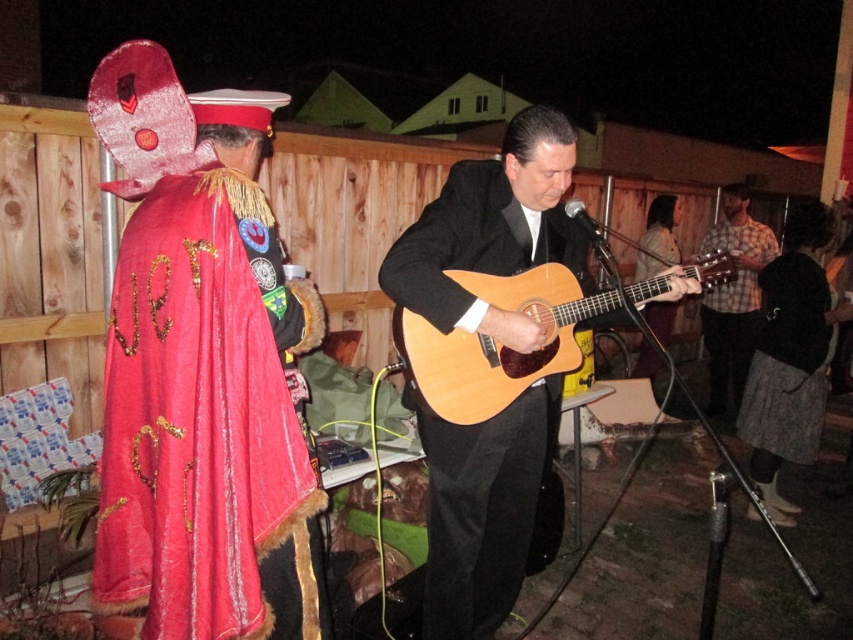
Who is taller, velvet red cape at left or wooden acoustic guitar at center?

With more height is wooden acoustic guitar at center.

Which is in front, point (196, 339) or point (650, 262)?

Positioned in front is point (196, 339).

Identify the location of velvet red cape at left. The image size is (853, 640). (201, 372).

Does natural wood acoustic guitar at center come in front of wooden acoustic guitar at center?

Yes.

The height and width of the screenshot is (640, 853). In order to click on natural wood acoustic guitar at center in this screenshot , I will do `click(495, 342)`.

Is point (451, 385) behind point (660, 337)?

No, it is not.

At what (x,y) coordinates should I click in order to perform the action: click on natural wood acoustic guitar at center. Please return your answer as a coordinate pair (x, y). The width and height of the screenshot is (853, 640). Looking at the image, I should click on tap(495, 342).

Is velvet red cape at left to the right of black woolen sweater at lower right from the viewer's perspective?

Incorrect, velvet red cape at left is not on the right side of black woolen sweater at lower right.

Is velvet red cape at left behind black woolen sweater at lower right?

No, it is not.

What do you see at coordinates (201, 372) in the screenshot? The width and height of the screenshot is (853, 640). I see `velvet red cape at left` at bounding box center [201, 372].

The image size is (853, 640). In order to click on velvet red cape at left in this screenshot , I will do `click(201, 372)`.